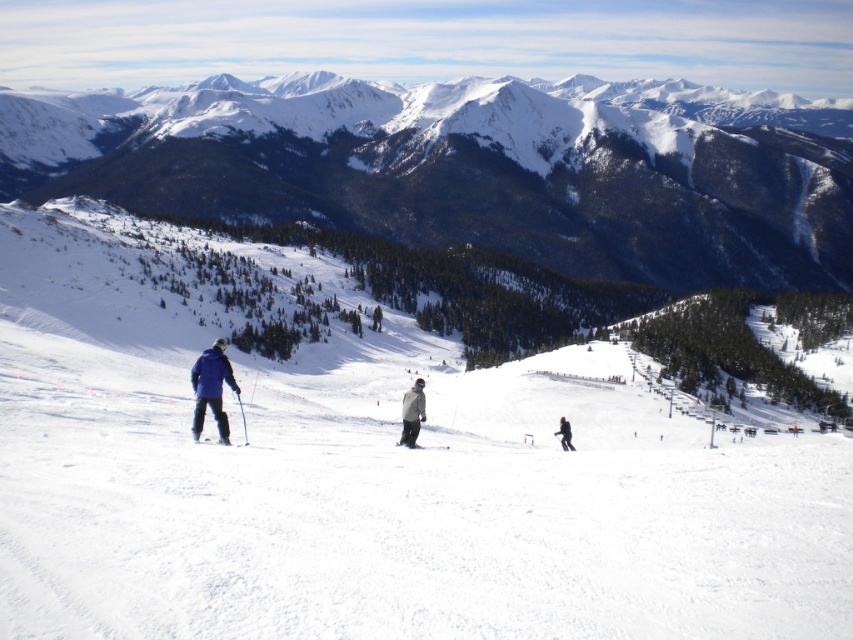
You are a photographer trying to capture a photo of the black matte jacket at center and the black matte ski at center. Which object should you zoom in on to ensure both are clearly visible in the frame?

The black matte jacket at center has a larger size compared to the black matte ski at center, so you should zoom in on the black matte jacket at center to ensure both are clearly visible in the frame.

You are a drone operator trying to capture a photo of the gray matte jacket at center. Your drone is currently hovering at point (x=412, y=413). Is the drone positioned directly above the gray matte jacket at center?

Yes, the point (x=412, y=413) indicates the gray matte jacket at center, so the drone is positioned directly above the gray matte jacket at center.

In the scene shown: You are a drone operator tasked with capturing aerial footage of the three skiers in the winter scene. The skiers are located at coordinates point A at (x=403, y=444), point B at 0.521, 0.389, and point C at 0.348, 0.304. Your drone has a maximum range of 150 feet. Can your drone capture footage of all three skiers in a single flight without exceeding its range?

The distance between the skiers at point A at (x=403, y=444) and point B at 0.521, 0.389 is 143.77 feet. Since the drone has a maximum range of 150 feet, it can capture footage of all three skiers in a single flight as the distance between the farthest skiers is within the drone range.